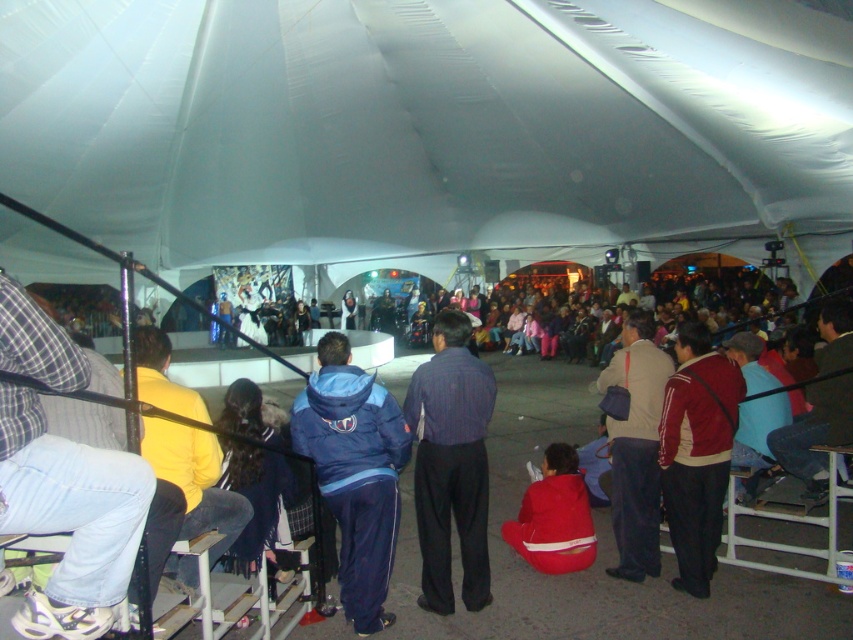
Does dark blue striped shirt at center have a lesser height compared to red fabric jacket at center?

In fact, dark blue striped shirt at center may be taller than red fabric jacket at center.

Is dark blue striped shirt at center smaller than red fabric jacket at center?

Incorrect, dark blue striped shirt at center is not smaller in size than red fabric jacket at center.

At what (x,y) coordinates should I click in order to perform the action: click on dark blue striped shirt at center. Please return your answer as a coordinate pair (x, y). This screenshot has width=853, height=640. Looking at the image, I should click on (451, 464).

The image size is (853, 640). I want to click on dark blue striped shirt at center, so click(451, 464).

Between point (231, 524) and point (781, 440), which one is positioned in front?

Point (231, 524) is more forward.

Which is more to the left, yellow fabric jacket at left or red fabric jacket at center?

yellow fabric jacket at left is more to the left.

Is point (210, 566) positioned before point (846, 358)?

Yes, point (210, 566) is in front of point (846, 358).

At what (x,y) coordinates should I click in order to perform the action: click on yellow fabric jacket at left. Please return your answer as a coordinate pair (x, y). This screenshot has height=640, width=853. Looking at the image, I should click on (195, 481).

Can you confirm if red jacket at center is bigger than matte brown jacket at center?

No, red jacket at center is not bigger than matte brown jacket at center.

Measure the distance between point (697, 461) and camera.

Point (697, 461) is 4.97 meters away from camera.

Locate an element on the screen. This screenshot has width=853, height=640. red jacket at center is located at coordinates (697, 452).